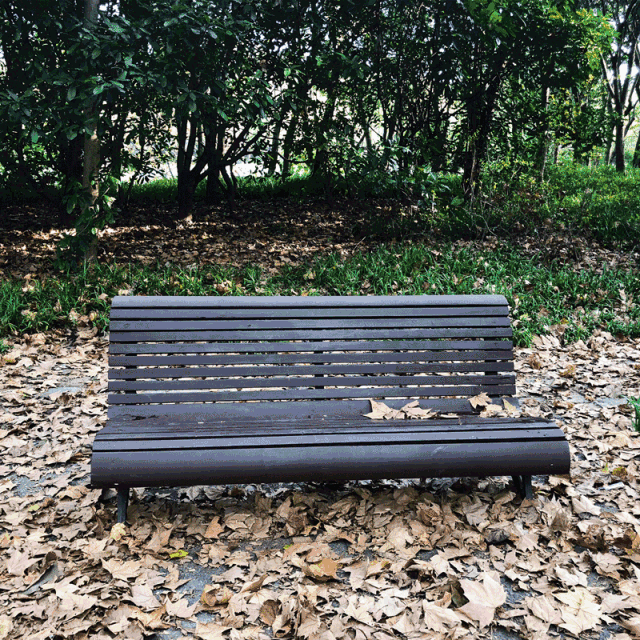
In order to click on bench in this screenshot , I will do `click(308, 410)`.